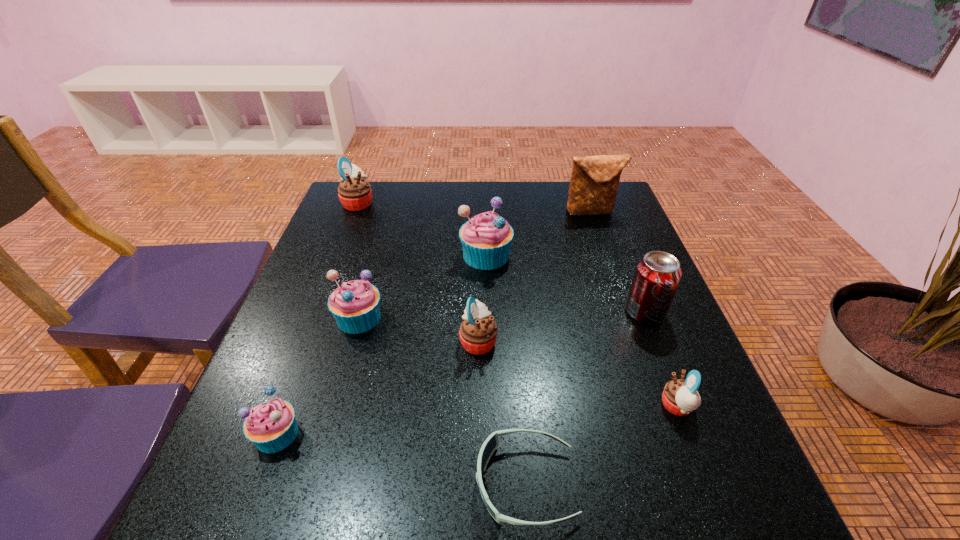
Identify which muffin is located as the fourth nearest to the tallest object. Please provide its 2D coordinates. Your answer should be formatted as a tuple, i.e. [(x, y)], where the tuple contains the x and y coordinates of a point satisfying the conditions above.

[(355, 304)]

At what (x,y) coordinates should I click in order to perform the action: click on muffin that is the third nearest to the nearest blue muffin. Please return your answer as a coordinate pair (x, y). The width and height of the screenshot is (960, 540). Looking at the image, I should click on tap(486, 239).

Find the location of a particular element. pink muffin that is the closest to the second biggest pink muffin is located at coordinates (680, 397).

Locate which pink muffin ranks second in proximity to the shortest object. Please provide its 2D coordinates. Your answer should be formatted as a tuple, i.e. [(x, y)], where the tuple contains the x and y coordinates of a point satisfying the conditions above.

[(680, 397)]

This screenshot has height=540, width=960. I want to click on blue muffin that is the third closest one to the goggles, so click(486, 239).

The image size is (960, 540). Find the location of `blue muffin that is the nearest to the soda can`. blue muffin that is the nearest to the soda can is located at coordinates (486, 239).

Where is `free location that satisfies the following two spatial constraints: 1. on the front-facing side of the soda can; 2. on the left side of the biggest pink muffin`? Image resolution: width=960 pixels, height=540 pixels. free location that satisfies the following two spatial constraints: 1. on the front-facing side of the soda can; 2. on the left side of the biggest pink muffin is located at coordinates (315, 312).

The image size is (960, 540). What are the coordinates of `free space that satisfies the following two spatial constraints: 1. on the open side of the tallest object; 2. on the front-facing side of the goggles` in the screenshot? It's located at (686, 483).

Where is `vacant space that satisfies the following two spatial constraints: 1. on the front-facing side of the second biggest blue muffin; 2. on the right side of the leftmost pink muffin`? This screenshot has height=540, width=960. vacant space that satisfies the following two spatial constraints: 1. on the front-facing side of the second biggest blue muffin; 2. on the right side of the leftmost pink muffin is located at coordinates (313, 318).